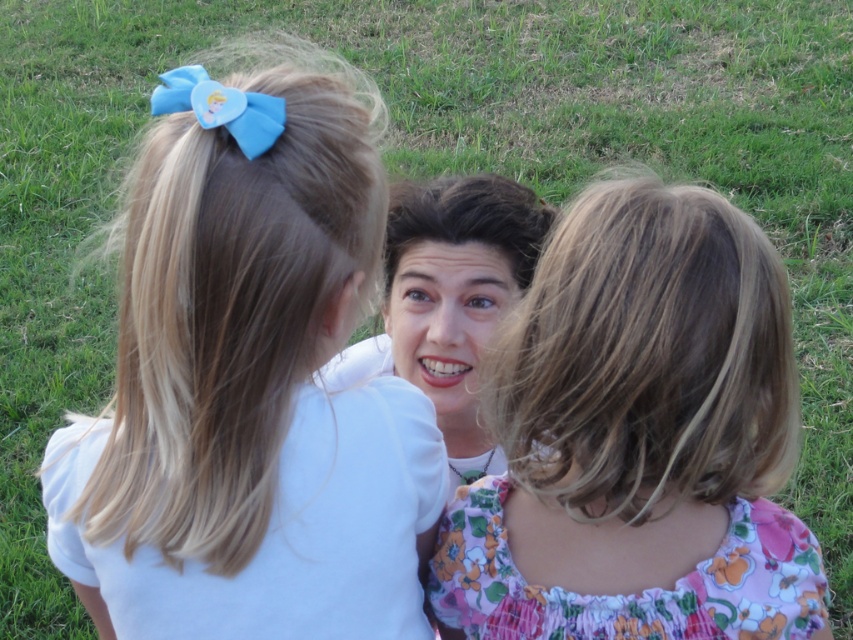
Question: Does smooth brown hair at center appear over matte fabric bow at upper left?

Choices:
 (A) yes
 (B) no

Answer: (B)

Question: Which object appears closest to the camera in this image?

Choices:
 (A) dark brown silky hair at center
 (B) blue fabric bow at upper left
 (C) matte fabric bow at upper left

Answer: (C)

Question: Considering the relative positions of floral fabric dress at center and smooth brown hair at center in the image provided, where is floral fabric dress at center located with respect to smooth brown hair at center?

Choices:
 (A) right
 (B) left

Answer: (A)

Question: Is smooth brown hair at center positioned at the back of dark brown silky hair at center?

Choices:
 (A) yes
 (B) no

Answer: (B)

Question: Which object appears farthest from the camera in this image?

Choices:
 (A) floral fabric dress at center
 (B) matte fabric bow at upper left

Answer: (A)

Question: Which point appears closest to the camera in this image?

Choices:
 (A) (524, 538)
 (B) (540, 211)
 (C) (476, 196)
 (D) (326, 284)

Answer: (D)